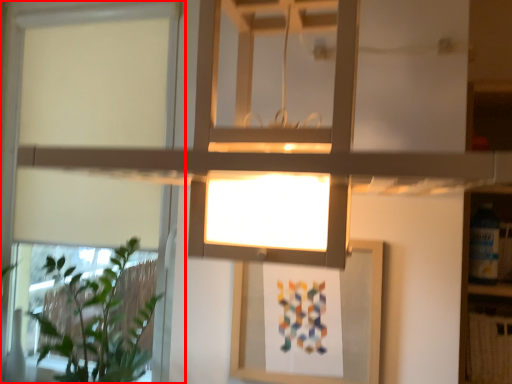
Question: In this image, where is window (annotated by the red box) located relative to houseplant?

Choices:
 (A) right
 (B) left

Answer: (B)